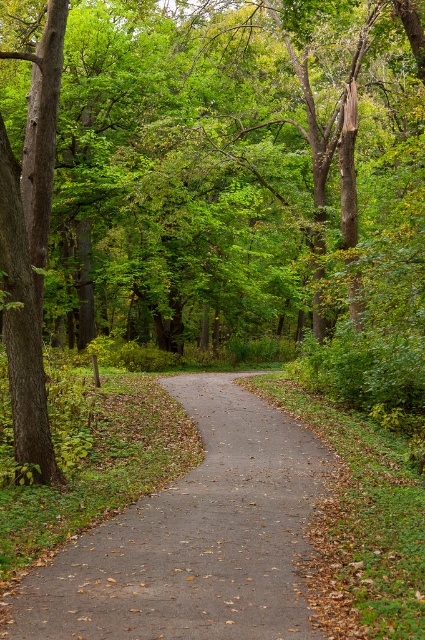
Question: Which point appears farthest from the camera in this image?

Choices:
 (A) (235, 394)
 (B) (11, 264)

Answer: (A)

Question: Can you confirm if dull gray asphalt at center is positioned below brown rough bark tree at left?

Choices:
 (A) yes
 (B) no

Answer: (A)

Question: Is dull gray asphalt at center further to camera compared to brown rough bark tree at left?

Choices:
 (A) yes
 (B) no

Answer: (B)

Question: Is dull gray asphalt at center thinner than brown rough bark tree at left?

Choices:
 (A) no
 (B) yes

Answer: (A)

Question: Which object appears farthest from the camera in this image?

Choices:
 (A) brown rough bark tree at left
 (B) dull gray asphalt at center

Answer: (A)